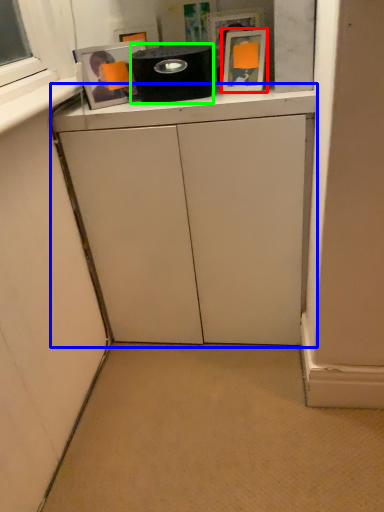
Question: Estimate the real-world distances between objects in this image. Which object is closer to picture frame (highlighted by a red box), cabinetry (highlighted by a blue box) or appliance (highlighted by a green box)?

Choices:
 (A) cabinetry
 (B) appliance

Answer: (B)